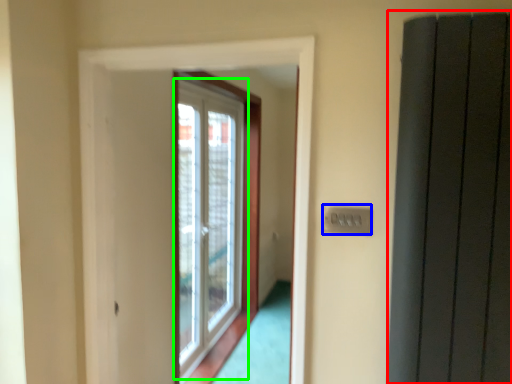
Question: Based on their relative distances, which object is nearer to elevator (highlighted by a red box)? Choose from electric outlet (highlighted by a blue box) and window (highlighted by a green box).

Choices:
 (A) electric outlet
 (B) window

Answer: (A)